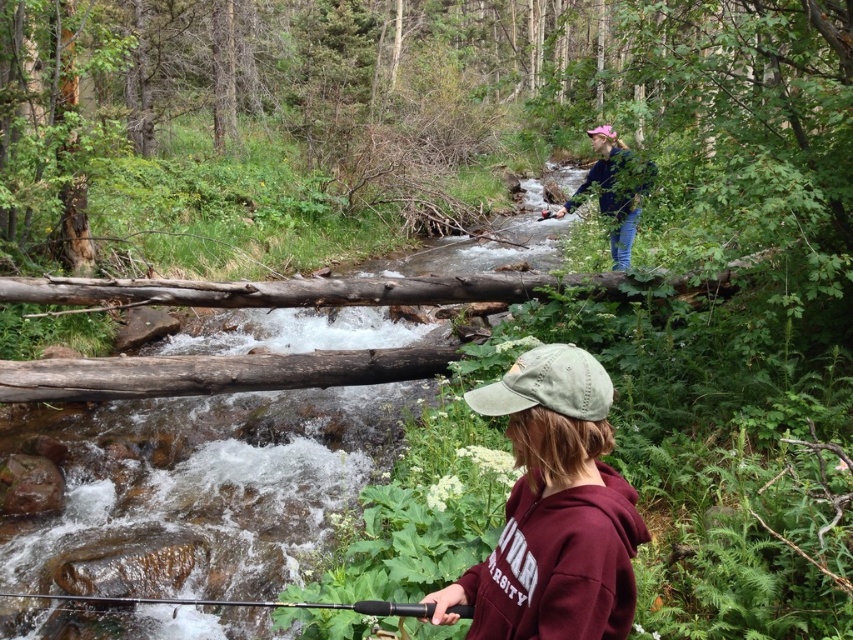
Question: Which of the following is the closest to the observer?

Choices:
 (A) pink fabric baseball hat at upper center
 (B) green fabric baseball cap at lower center

Answer: (B)

Question: Among these points, which one is nearest to the camera?

Choices:
 (A) (618, 586)
 (B) (589, 134)

Answer: (A)

Question: Which object appears closest to the camera in this image?

Choices:
 (A) green cotton cap at lower center
 (B) black textured fishing pole at lower center

Answer: (A)

Question: Is green cotton cap at lower center below pink fabric baseball hat at upper center?

Choices:
 (A) yes
 (B) no

Answer: (A)

Question: Can you confirm if green fabric baseball cap at lower center is positioned to the right of pink fabric baseball hat at upper center?

Choices:
 (A) yes
 (B) no

Answer: (B)

Question: Is green cotton cap at lower center wider than pink fabric baseball hat at upper center?

Choices:
 (A) no
 (B) yes

Answer: (B)